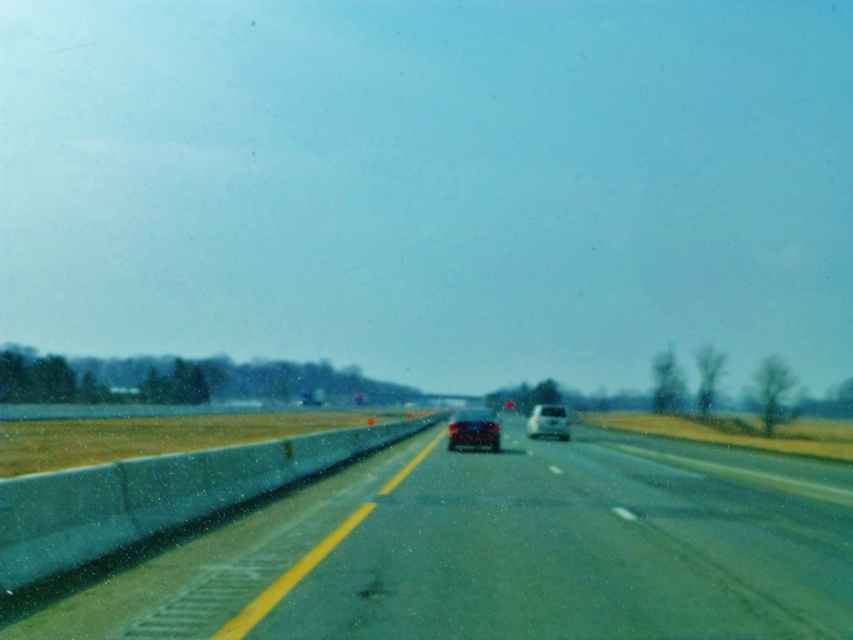
You are driving a car and see two points on the road ahead. The first point is at position point (846, 477) and the second point is at position point (456, 440). Which point is closer to your car?

Point (846, 477) is closer to the camera than point (456, 440), so the first point is closer to your car.

You are driving on the highway and notice two points marked on the road ahead. The first point is at coordinates point (x=786, y=541) and the second is at point (x=546, y=410). Based on the scene, which point is closer to your current position?

Point (x=786, y=541) is closer to the camera than point (x=546, y=410), so the first point is closer to your current position.

You are driving a car that is 4.5 meters long. You want to make sure you have enough space to safely pass through the smooth asphalt road at center. Is the road long enough for your car?

The smooth asphalt road at center is 8.05 meters from camera, which is longer than your car length of 4.5 meters. Therefore, the road is long enough for your car to pass safely.